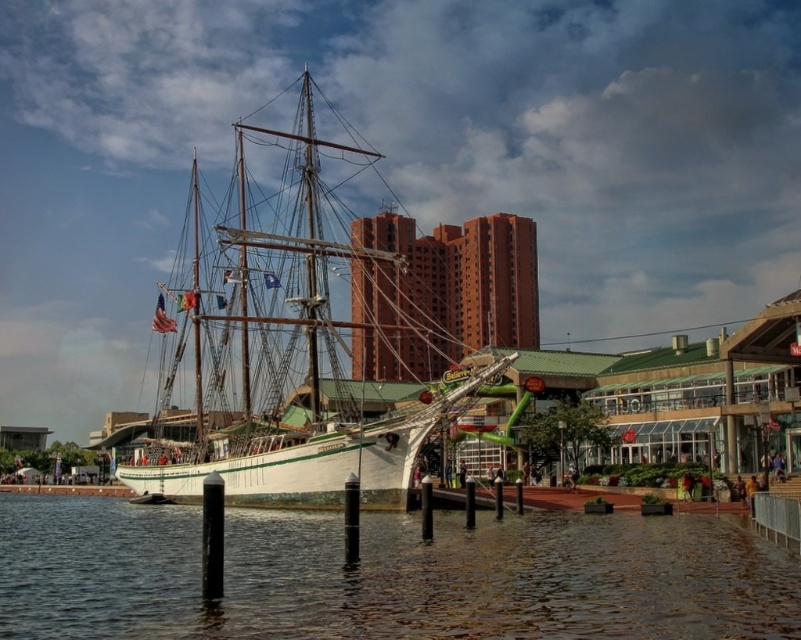
Question: Among these objects, which one is farthest from the camera?

Choices:
 (A) clear water at lower left
 (B) white matte ship at center

Answer: (B)

Question: Is clear water at lower left thinner than white matte ship at center?

Choices:
 (A) no
 (B) yes

Answer: (B)

Question: Can you confirm if clear water at lower left is smaller than white matte ship at center?

Choices:
 (A) no
 (B) yes

Answer: (B)

Question: Is the position of clear water at lower left less distant than that of white matte ship at center?

Choices:
 (A) yes
 (B) no

Answer: (A)